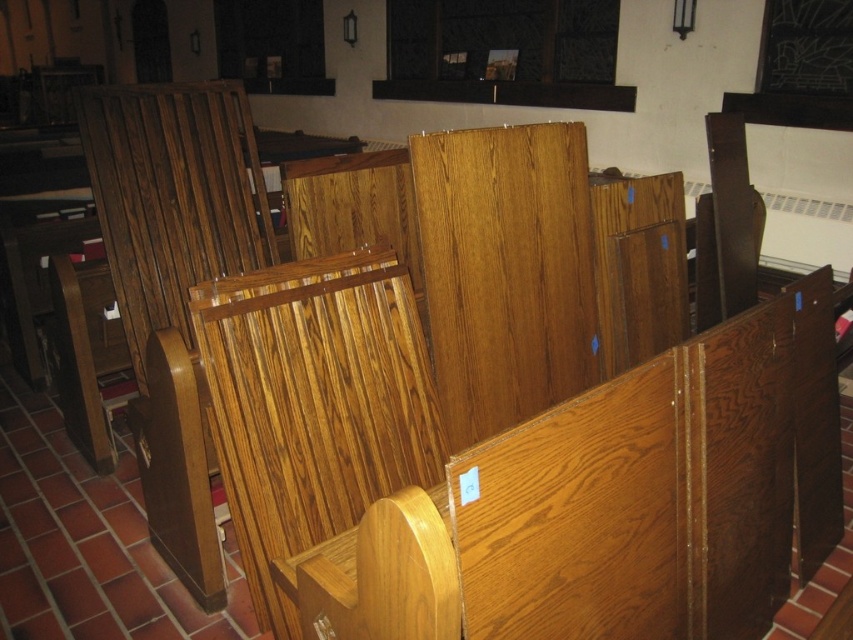
Question: Which point is farther to the camera?

Choices:
 (A) wooden church bench at center
 (B) wooden panel at center

Answer: (B)

Question: Does wooden church bench at center have a lesser width compared to wooden panel at center?

Choices:
 (A) yes
 (B) no

Answer: (B)

Question: Can you confirm if wooden church bench at center is positioned to the right of wooden panel at center?

Choices:
 (A) no
 (B) yes

Answer: (B)

Question: Is wooden church bench at center bigger than wooden panel at center?

Choices:
 (A) no
 (B) yes

Answer: (B)